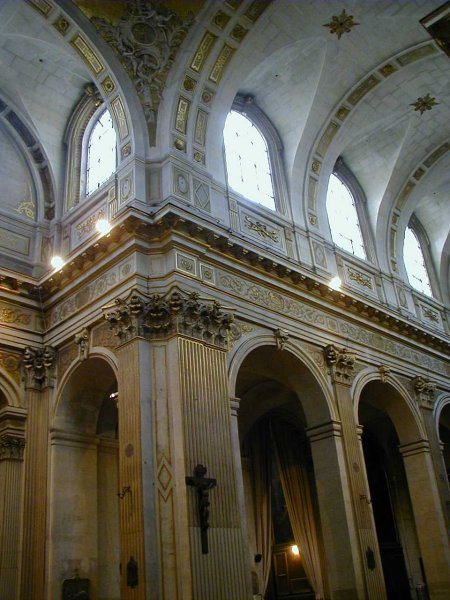
The image size is (450, 600). What are the coordinates of `windows` in the screenshot? It's located at (247, 163), (99, 155), (340, 213), (415, 260).